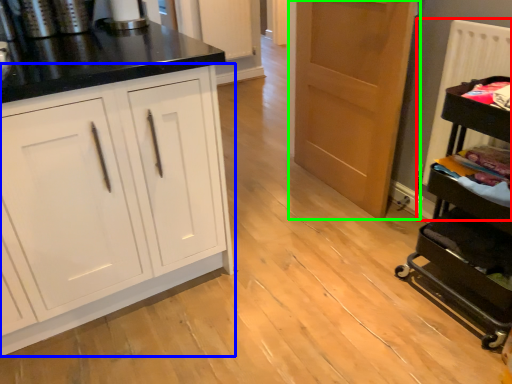
Question: Estimate the real-world distances between objects in this image. Which object is closer to radiator (highlighted by a red box), cabinetry (highlighted by a blue box) or door (highlighted by a green box)?

Choices:
 (A) cabinetry
 (B) door

Answer: (B)